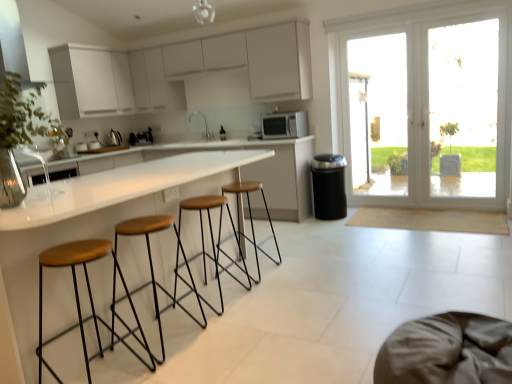
Image resolution: width=512 pixels, height=384 pixels. Find the location of `spots to the right of wooden seat stool at center, arranged as the 3th stool when viewed from the back`. spots to the right of wooden seat stool at center, arranged as the 3th stool when viewed from the back is located at coordinates (223, 340).